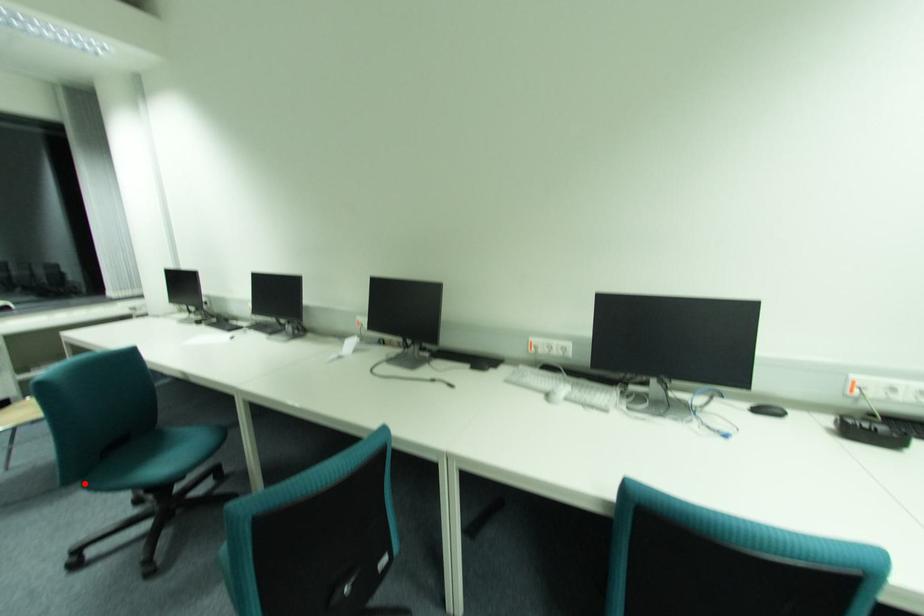
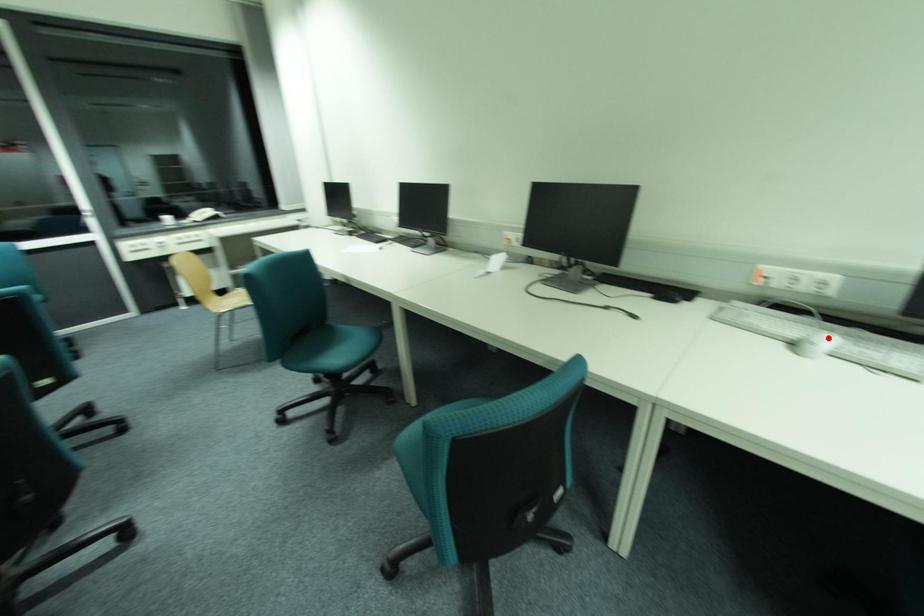
I am providing you with two images of the same scene from different viewpoints. A red point is marked on the first image and another point is marked on the second image. Is the red point in image1 aligned with the point shown in image2?

No